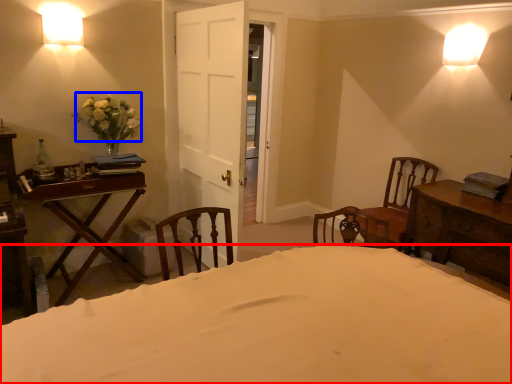
Question: Which point is closer to the camera, bed (highlighted by a red box) or flower (highlighted by a blue box)?

Choices:
 (A) bed
 (B) flower

Answer: (A)